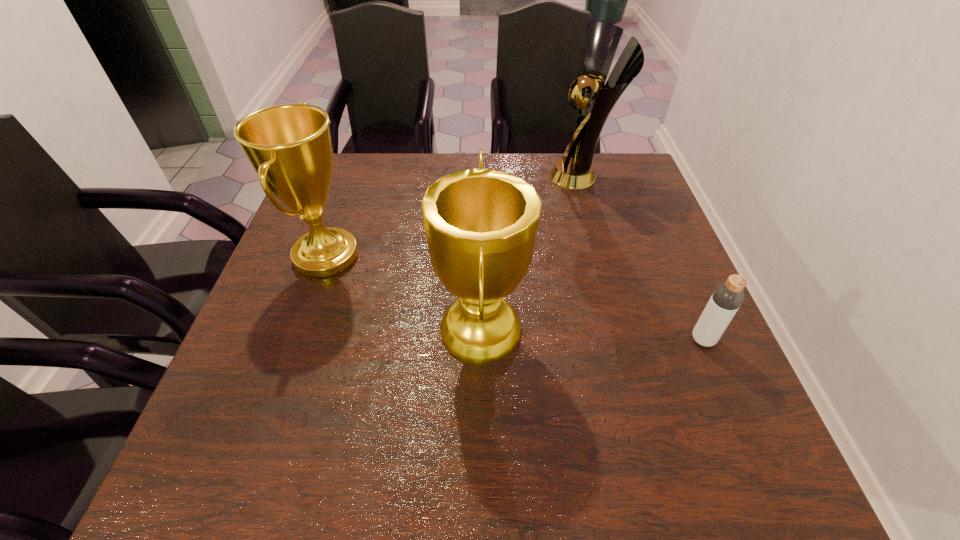
Image resolution: width=960 pixels, height=540 pixels. In order to click on vacant space located 0.130m on the shiny surface of the second award from left to right in this screenshot , I will do `click(371, 331)`.

Locate an element on the screen. vacant area situated on the shiny surface of the second award from left to right is located at coordinates (286, 331).

Where is `vacant space located on the shiny surface of the second award from left to right`? The height and width of the screenshot is (540, 960). vacant space located on the shiny surface of the second award from left to right is located at coordinates pos(400,331).

In order to click on free space located on the back of the shortest object in this screenshot , I will do `click(682, 290)`.

Image resolution: width=960 pixels, height=540 pixels. Find the location of `object present at the far edge`. object present at the far edge is located at coordinates (595, 99).

The width and height of the screenshot is (960, 540). Find the location of `object that is at the left edge`. object that is at the left edge is located at coordinates (289, 146).

The image size is (960, 540). I want to click on award that is positioned at the right edge, so click(595, 99).

The width and height of the screenshot is (960, 540). I want to click on bottle present at the right edge, so click(726, 299).

The width and height of the screenshot is (960, 540). Find the location of `object situated at the far right corner`. object situated at the far right corner is located at coordinates (595, 99).

Locate an element on the screen. free space at the far edge of the desktop is located at coordinates (422, 179).